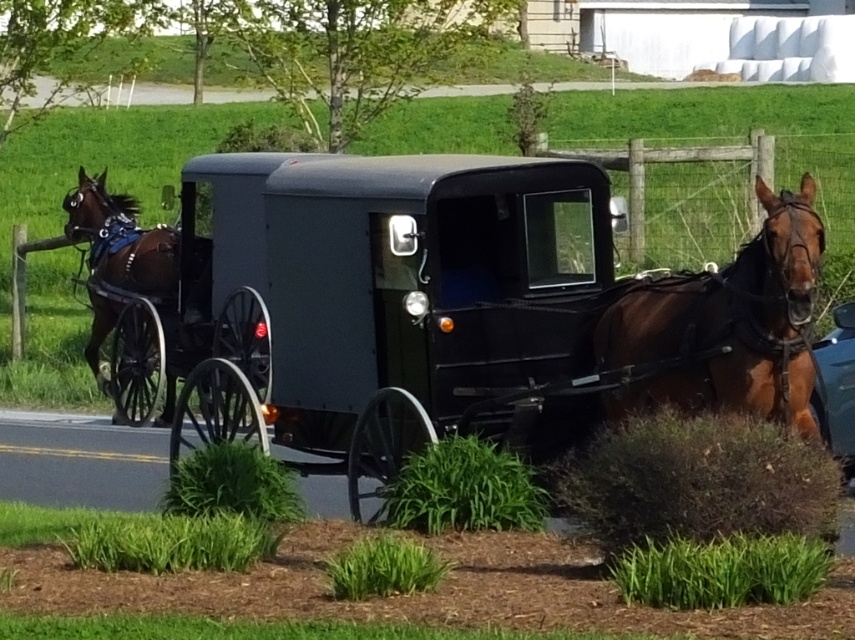
You are a delivery person who needs to transport a tall package that is 2 meters in height. You have access to both the matte black horse cart at center and the blue glossy car at right. Based on the scene, which vehicle would be more suitable for carrying this package without damaging it?

The blue glossy car at right is taller than the matte black horse cart at center, so the blue glossy car at right would be more suitable for carrying the tall package without damaging it.